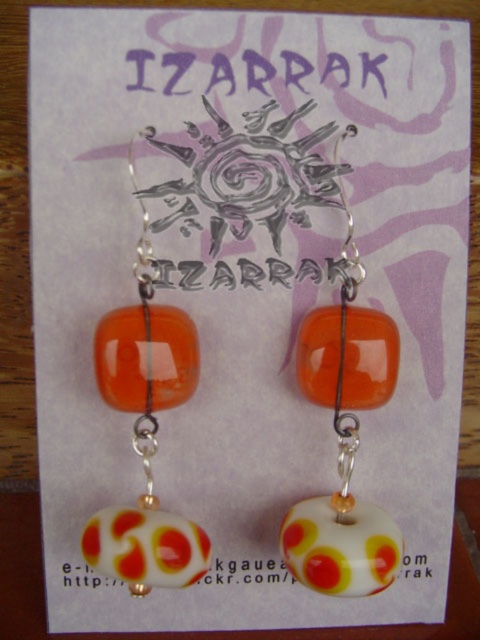
You are examining the earrings displayed on the card. You notice two orange beads at the center of each earring. Which bead is positioned closer to you, the orange glossy bead at center or the orange glass bead at center?

The orange glossy bead at center is closer to the viewer than the orange glass bead at center.